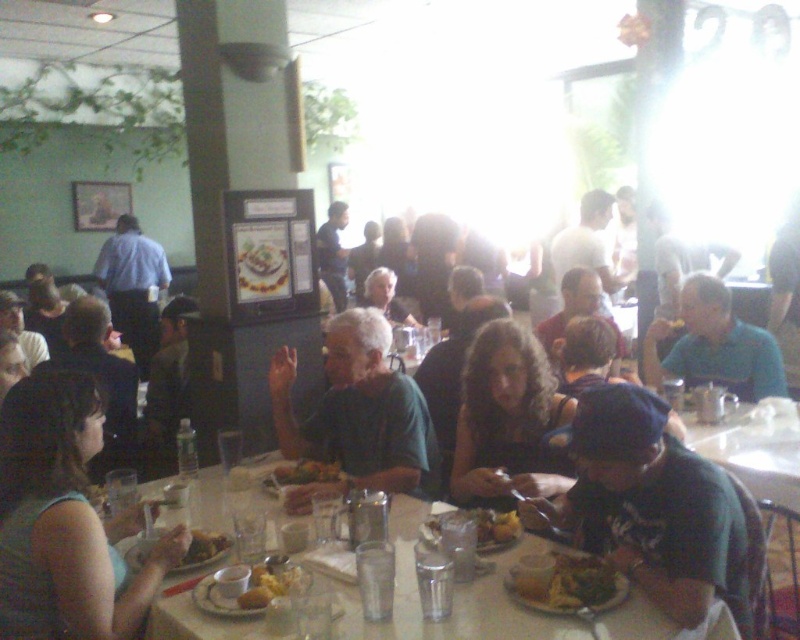
Can you confirm if blue shirt at center is positioned below green leafy salad at center?

Actually, blue shirt at center is above green leafy salad at center.

Looking at this image, who is more distant from viewer, (700, 275) or (574, 577)?

Point (700, 275)

In order to click on blue shirt at center in this screenshot , I will do [714, 346].

At what (x,y) coordinates should I click in order to perform the action: click on blue shirt at center. Please return your answer as a coordinate pair (x, y). Looking at the image, I should click on (714, 346).

Can you confirm if blue shirt at center is positioned above matte plastic cup at center?

Correct, blue shirt at center is located above matte plastic cup at center.

Does point (780, 378) come farther from viewer compared to point (436, 518)?

Yes, point (780, 378) is behind point (436, 518).

Is point (756, 346) more distant than point (516, 524)?

Yes.

I want to click on blue shirt at center, so click(x=714, y=346).

Does point (500, 525) lie in front of point (186, 550)?

No.

Is point (488, 515) farther from camera compared to point (193, 566)?

Yes, point (488, 515) is farther from viewer.

Image resolution: width=800 pixels, height=640 pixels. Describe the element at coordinates (480, 528) in the screenshot. I see `matte plastic cup at center` at that location.

Locate an element on the screen. This screenshot has height=640, width=800. matte plastic cup at center is located at coordinates pyautogui.click(x=480, y=528).